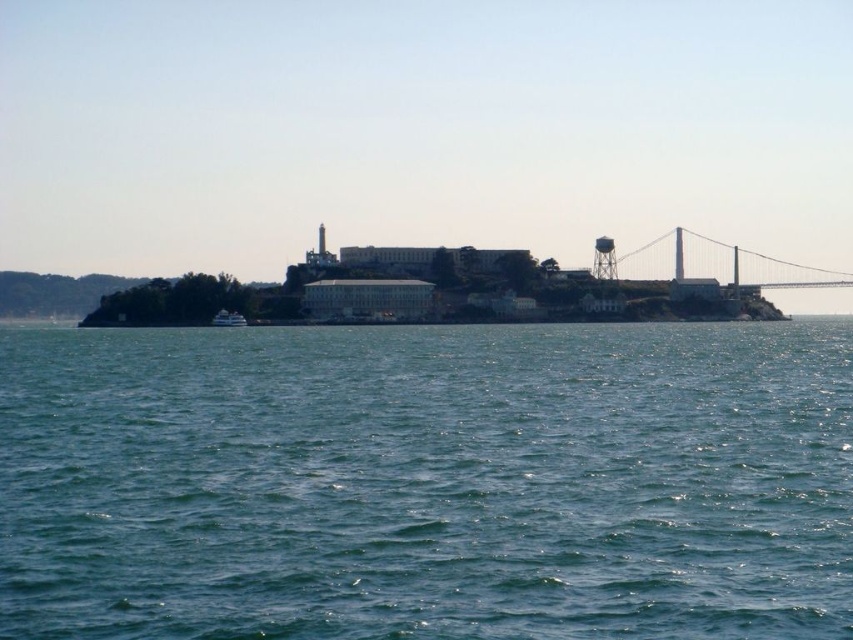
Describe the element at coordinates (706, 262) in the screenshot. I see `metallic gray bridge at right` at that location.

Between metallic gray bridge at right and white glossy boat at lower left, which one appears on the right side from the viewer's perspective?

metallic gray bridge at right

Is point (618, 257) more distant than point (235, 317)?

Yes, it is behind point (235, 317).

You are a GUI agent. You are given a task and a screenshot of the screen. Output one action in this format:
    pyautogui.click(x=<x>, y=<y>)
    Task: Click on the metallic gray bridge at right
    
    Given the screenshot: What is the action you would take?
    pyautogui.click(x=706, y=262)

Is blue water at center wider than metallic gray bridge at right?

Yes.

Is the position of blue water at center less distant than that of metallic gray bridge at right?

Yes, blue water at center is closer to the viewer.

Is point (383, 388) positioned behind point (831, 275)?

No, it is not.

Identify the location of blue water at center. The image size is (853, 640). (427, 483).

Is blue water at center taller than white glossy boat at lower left?

Correct, blue water at center is much taller as white glossy boat at lower left.

Is blue water at center above white glossy boat at lower left?

No, blue water at center is not above white glossy boat at lower left.

Locate an element on the screen. Image resolution: width=853 pixels, height=640 pixels. blue water at center is located at coordinates (427, 483).